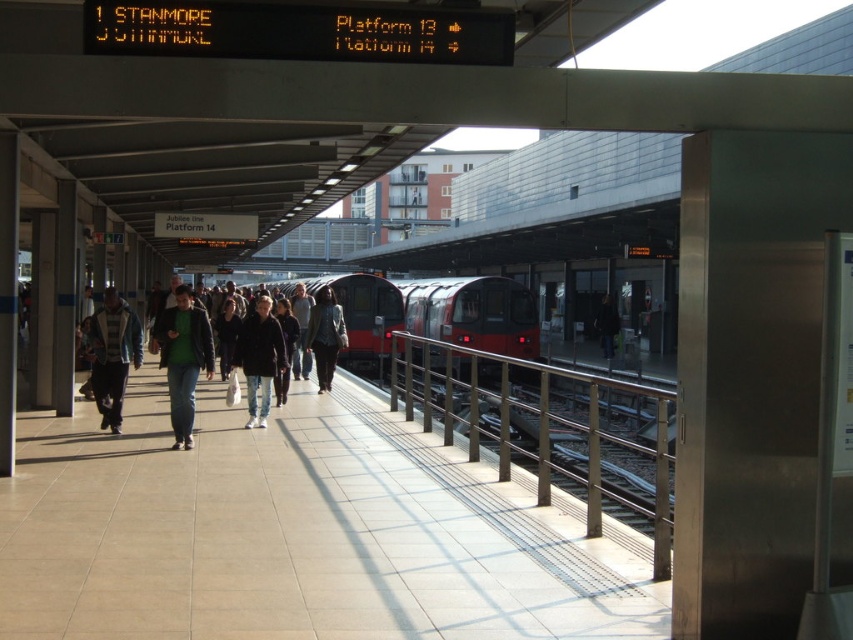
You are standing on the train station platform and see two points marked on the ground. The first point is at coordinates point (392, 337) and the second point is at point (103, 396). Which point is closer to you?

Answer: Point (392, 337) is closer to you because it is further to the camera than point (103, 396), meaning it is nearer in the scene.

You are standing on the platform at the train station and see a point marked at coordinates (549, 426). What object is located at that point?

The point at coordinates (549, 426) marks the polished metal rail at right.

You are standing on the train platform and see the polished metal rail at right and the dark gray hoodie at center. Which object is closer to the ground?

The polished metal rail at right is below the dark gray hoodie at center, so it is closer to the ground.